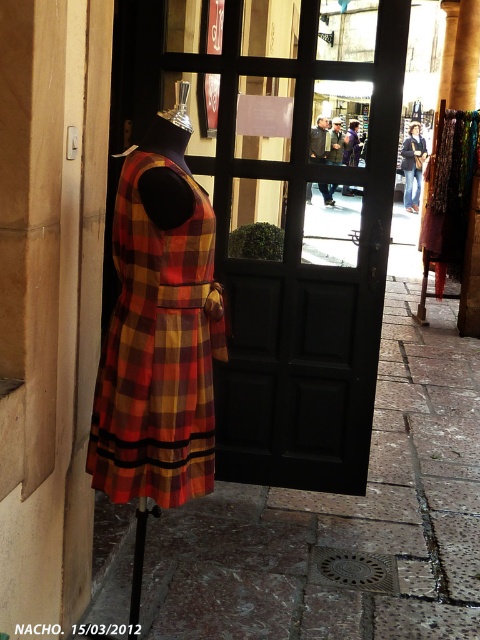
Question: Which point is closer to the camera?

Choices:
 (A) (170, 298)
 (B) (305, 188)
 (C) (211, 168)

Answer: (A)

Question: Which point appears farthest from the camera in this image?

Choices:
 (A) (262, 548)
 (B) (191, 380)
 (C) (333, 124)

Answer: (C)

Question: Can you confirm if marble pavement at center is positioned to the left of dark gray suit at center?

Choices:
 (A) no
 (B) yes

Answer: (A)

Question: Does denim jacket at center have a greater width compared to dark gray suit at center?

Choices:
 (A) no
 (B) yes

Answer: (B)

Question: Which point is closer to the camera taking this photo?

Choices:
 (A) (332, 156)
 (B) (144, 296)

Answer: (B)

Question: Is denim jacket at center below dark gray suit at center?

Choices:
 (A) no
 (B) yes

Answer: (A)